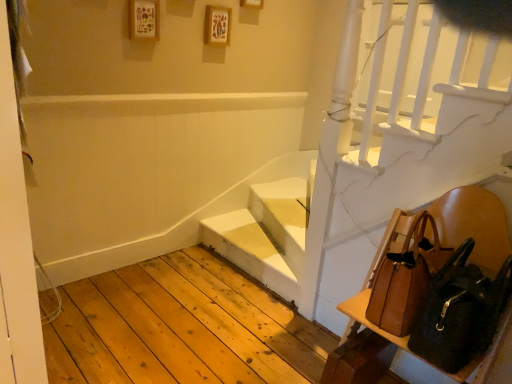
The height and width of the screenshot is (384, 512). In order to click on free location above white matte stairs at center (from a real-world perspective) in this screenshot , I will do (x=250, y=235).